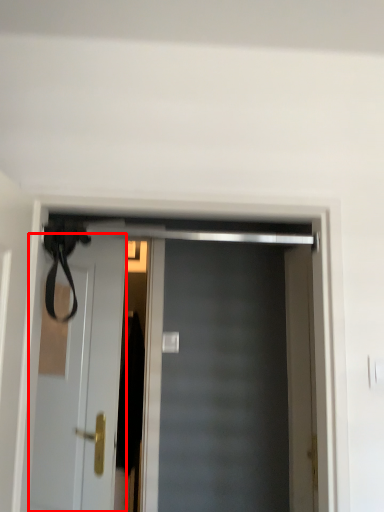
Question: From the image's perspective, where is door (annotated by the red box) located in relation to door in the image?

Choices:
 (A) below
 (B) above

Answer: (A)